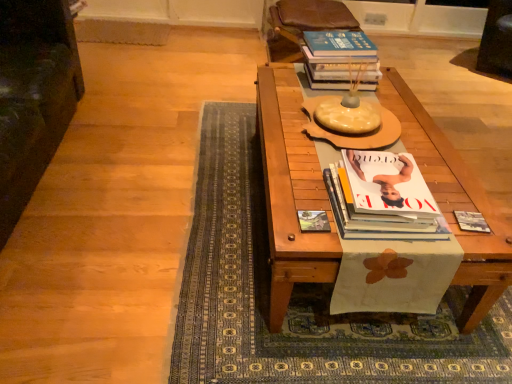
In order to click on vacant space in between white glossy magazine at center, the first book in the front-to-back sequence, and matte black book at right, which is the 1th book in bottom-to-top order in this screenshot , I will do `click(452, 218)`.